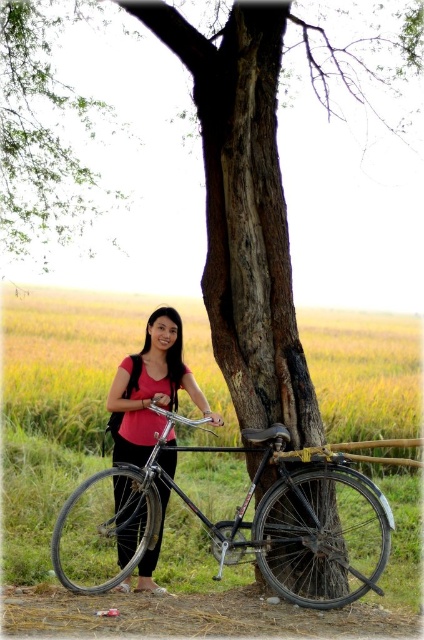
Is green leafy tree at upper left wider than matte pink shirt at center?

Indeed, green leafy tree at upper left has a greater width compared to matte pink shirt at center.

At what (x,y) coordinates should I click in order to perform the action: click on green leafy tree at upper left. Please return your answer as a coordinate pair (x, y). This screenshot has width=424, height=640. Looking at the image, I should click on (45, 132).

You are a GUI agent. You are given a task and a screenshot of the screen. Output one action in this format:
    pyautogui.click(x=<x>, y=<y>)
    Task: Click on the green leafy tree at upper left
    The width and height of the screenshot is (424, 640).
    Given the screenshot: What is the action you would take?
    pyautogui.click(x=45, y=132)

Does point (111, 522) come behind point (148, 454)?

Yes.

You are a GUI agent. You are given a task and a screenshot of the screen. Output one action in this format:
    pyautogui.click(x=<x>, y=<y>)
    Task: Click on the shiny metallic bicycle at center
    
    Given the screenshot: What is the action you would take?
    pyautogui.click(x=225, y=520)

In the scene shown: Does green leafy tree at upper left have a greater width compared to shiny metallic bicycle at center?

No.

Describe the element at coordinates (45, 132) in the screenshot. I see `green leafy tree at upper left` at that location.

Where is `green leafy tree at upper left`? This screenshot has width=424, height=640. green leafy tree at upper left is located at coordinates (45, 132).